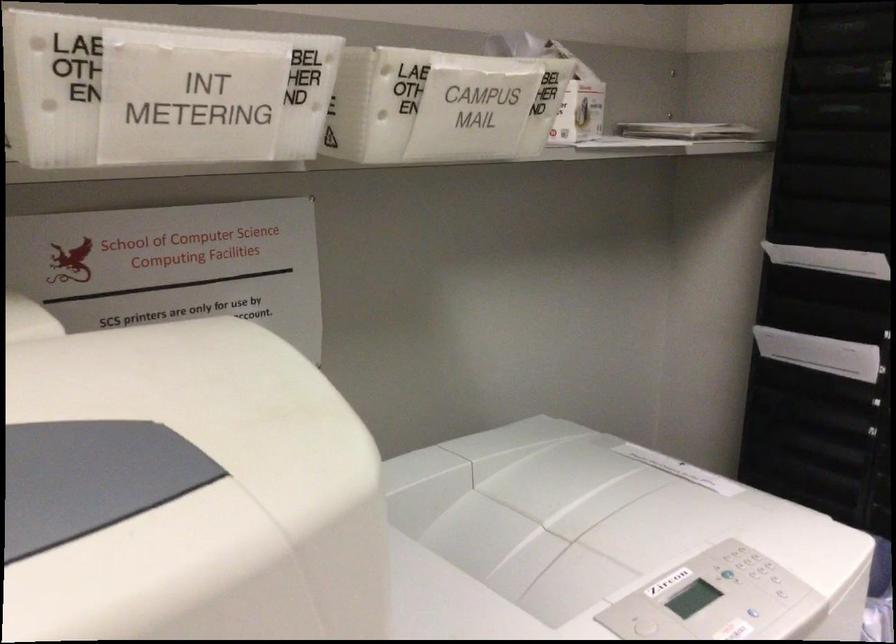
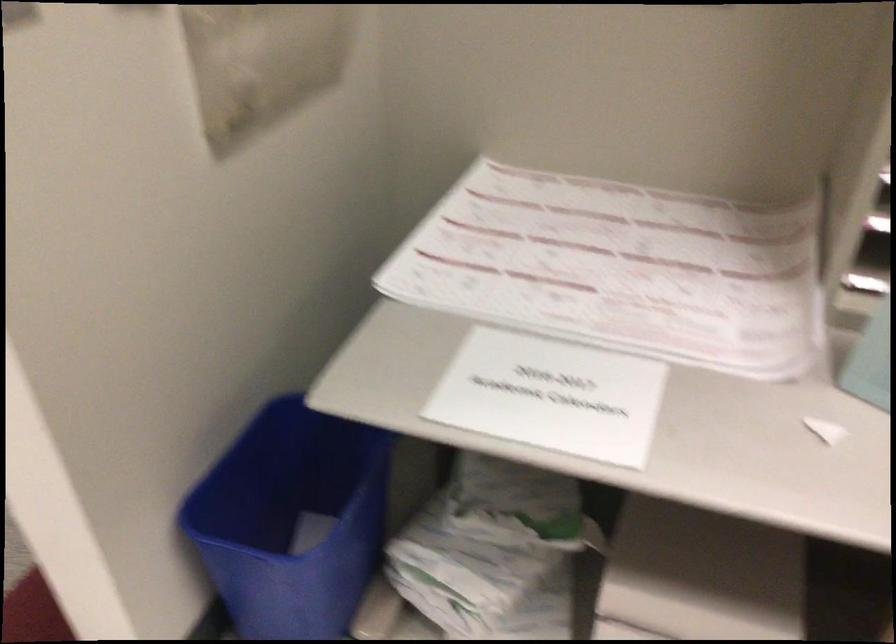
The images are taken continuously from a first-person perspective. In which direction is your viewpoint rotating?

The camera rotated toward right-down.